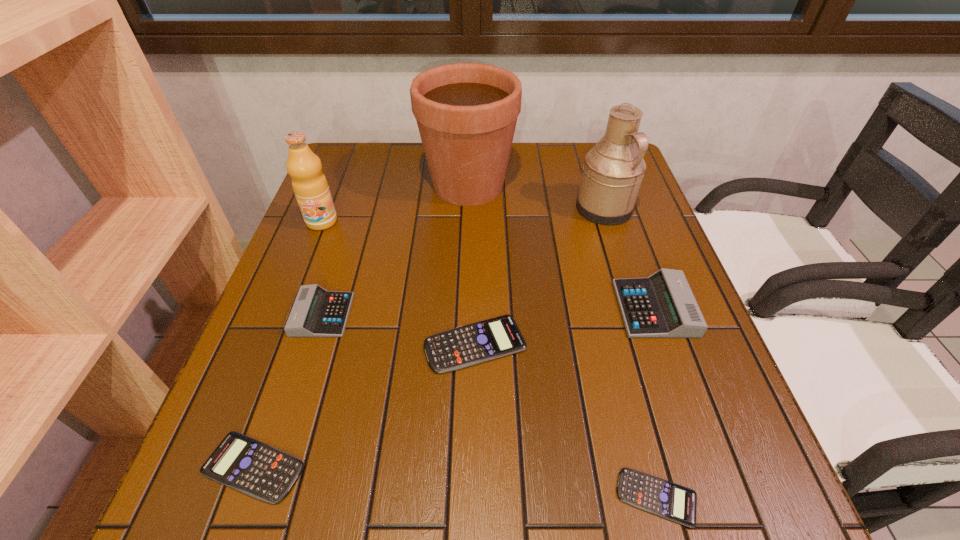
In the image, there is a desktop. Where is `free region at the far left corner`? free region at the far left corner is located at coordinates (381, 146).

Locate an element on the screen. Image resolution: width=960 pixels, height=540 pixels. vacant area that lies between the left gray calculator and the leftmost blue calculator is located at coordinates (288, 390).

Locate an element on the screen. This screenshot has height=540, width=960. free space between the pitcher and the second blue calculator from left to right is located at coordinates (540, 276).

Image resolution: width=960 pixels, height=540 pixels. I want to click on free space between the fruit juice and the biggest blue calculator, so click(398, 282).

Locate an element on the screen. The height and width of the screenshot is (540, 960). free point between the flowerpot and the second tallest calculator is located at coordinates (396, 250).

This screenshot has height=540, width=960. I want to click on empty space that is in between the seventh tallest object and the flowerpot, so click(x=361, y=326).

At what (x,y) coordinates should I click in order to perform the action: click on vacant area that lies between the flowerpot and the sixth shortest object. Please return your answer as a coordinate pair (x, y). Looking at the image, I should click on (396, 204).

Identify the location of unoccupied position between the second tallest calculator and the pitcher. (464, 262).

Identify the location of free space between the smallest blue calculator and the leftmost blue calculator. (455, 482).

At what (x,y) coordinates should I click in order to perform the action: click on vacant space that is in between the flowerpot and the smallest blue calculator. Please return your answer as a coordinate pair (x, y). Looking at the image, I should click on (563, 341).